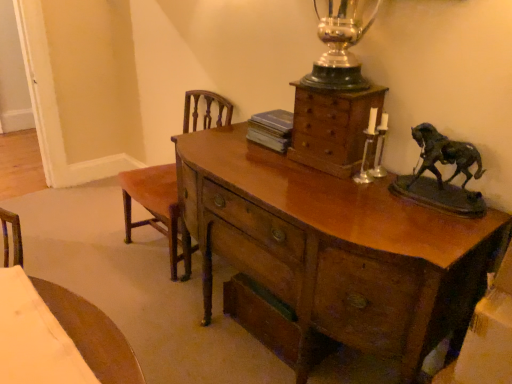
Describe the element at coordinates (332, 127) in the screenshot. The width and height of the screenshot is (512, 384). I see `wooden chest of drawers at upper center` at that location.

Locate an element on the screen. The height and width of the screenshot is (384, 512). blue paperback book at center is located at coordinates (271, 129).

You are a GUI agent. You are given a task and a screenshot of the screen. Output one action in this format:
    pyautogui.click(x=<x>, y=<y>)
    Task: Click on the wooden chest of drawers at upper center
    Image resolution: width=512 pixels, height=384 pixels.
    Given the screenshot: What is the action you would take?
    pyautogui.click(x=332, y=127)

The width and height of the screenshot is (512, 384). Identify the location of desk lying on the left of wooden chest of drawers at upper center. (328, 253).

Can you confirm if wooden chest of drawers at upper center is taller than glossy wood desk at center?

In fact, wooden chest of drawers at upper center may be shorter than glossy wood desk at center.

Based on their sizes in the image, would you say wooden chest of drawers at upper center is bigger or smaller than glossy wood desk at center?

wooden chest of drawers at upper center is smaller than glossy wood desk at center.

From a real-world perspective, is wooden chest of drawers at upper center beneath glossy wood desk at center?

Incorrect, from a real-world perspective, wooden chest of drawers at upper center is higher than glossy wood desk at center.

Can you tell me how much glossy wood desk at center and brown wood chair at left differ in facing direction?

There is a 0.0952-degree angle between the facing directions of glossy wood desk at center and brown wood chair at left.

Would you say brown wood chair at left is part of glossy wood desk at center's contents?

No, glossy wood desk at center does not contain brown wood chair at left.

Where is `desk in front of the brown wood chair at left`? desk in front of the brown wood chair at left is located at coordinates (328, 253).

Which of these two, glossy wood desk at center or brown wood chair at left, is wider?

glossy wood desk at center is wider.

Which is in front, blue paperback book at center or glossy wood desk at center?

Positioned in front is glossy wood desk at center.

From the picture: Is blue paperback book at center directly adjacent to glossy wood desk at center?

blue paperback book at center and glossy wood desk at center are clearly separated.

Which of these two, blue paperback book at center or glossy wood desk at center, stands shorter?

Standing shorter between the two is blue paperback book at center.

Is brown wood chair at left far away from blue paperback book at center?

brown wood chair at left is actually quite close to blue paperback book at center.

Is brown wood chair at left looking in the opposite direction of blue paperback book at center?

No, brown wood chair at left's orientation is not away from blue paperback book at center.

Is point (172, 267) farther from camera compared to point (267, 134)?

That is True.

From the image's perspective, between blue paperback book at center and brown wood chair at left, which one is located above?

From the image's view, blue paperback book at center is above.

Can you tell me how much blue paperback book at center and brown wood chair at left differ in facing direction?

The angular difference between blue paperback book at center and brown wood chair at left is 0.911 degrees.

Between blue paperback book at center and brown wood chair at left, which one has more height?

brown wood chair at left.

Which object is positioned more to the right, blue paperback book at center or brown wood chair at left?

From the viewer's perspective, blue paperback book at center appears more on the right side.

Measure the distance from glossy wood desk at center to blue paperback book at center.

The distance of glossy wood desk at center from blue paperback book at center is 19.56 inches.

Who is bigger, glossy wood desk at center or blue paperback book at center?

glossy wood desk at center.

Consider the image. Considering their positions, is glossy wood desk at center located in front of or behind blue paperback book at center?

glossy wood desk at center is in front of blue paperback book at center.

From the image's perspective, is glossy wood desk at center positioned above or below blue paperback book at center?

Based on their image positions, glossy wood desk at center is located beneath blue paperback book at center.

From the picture: Is brown wood chair at left not inside glossy wood desk at center?

Indeed, brown wood chair at left is completely outside glossy wood desk at center.

Is brown wood chair at left wider or thinner than glossy wood desk at center?

brown wood chair at left is thinner than glossy wood desk at center.

Locate an element on the screen. This screenshot has height=384, width=512. armchair above the glossy wood desk at center (from a real-world perspective) is located at coordinates (154, 204).

Where is `chest of drawers lying on the right of glossy wood desk at center`? This screenshot has width=512, height=384. chest of drawers lying on the right of glossy wood desk at center is located at coordinates (332, 127).

Find the location of a particular element. Image resolution: width=512 pixels, height=384 pixels. desk that appears below the brown wood chair at left (from the image's perspective) is located at coordinates (328, 253).

Looking at the image, which one is located further to blue paperback book at center, brown wood chair at left or wooden chest of drawers at upper center?

brown wood chair at left.

Consider the image. Looking at the image, which one is located closer to brown wood chair at left, glossy wood desk at center or blue paperback book at center?

Based on the image, blue paperback book at center appears to be nearer to brown wood chair at left.

When comparing their distances from glossy wood desk at center, does blue paperback book at center or brown wood chair at left seem further?

The object further to glossy wood desk at center is brown wood chair at left.

When comparing their distances from blue paperback book at center, does wooden chest of drawers at upper center or brown wood chair at left seem further?

brown wood chair at left is positioned further to the anchor blue paperback book at center.

Looking at the image, which one is located closer to glossy wood desk at center, brown wood chair at left or wooden chest of drawers at upper center?

wooden chest of drawers at upper center is positioned closer to the anchor glossy wood desk at center.

Based on the photo, which object lies further to the anchor point blue paperback book at center, glossy wood desk at center or brown wood chair at left?

Among the two, brown wood chair at left is located further to blue paperback book at center.

When comparing their distances from brown wood chair at left, does blue paperback book at center or wooden chest of drawers at upper center seem closer?

blue paperback book at center.

From the image, which object appears to be farther from blue paperback book at center, brown wood chair at left or glossy wood desk at center?

Based on the image, brown wood chair at left appears to be further to blue paperback book at center.

Where is `book between brown wood chair at left and wooden chest of drawers at upper center from left to right`? The height and width of the screenshot is (384, 512). book between brown wood chair at left and wooden chest of drawers at upper center from left to right is located at coordinates (271, 129).

Where is `book between glossy wood desk at center and brown wood chair at left along the z-axis`? Image resolution: width=512 pixels, height=384 pixels. book between glossy wood desk at center and brown wood chair at left along the z-axis is located at coordinates (271, 129).

This screenshot has height=384, width=512. Find the location of `the chest of drawers positioned between glossy wood desk at center and blue paperback book at center from near to far`. the chest of drawers positioned between glossy wood desk at center and blue paperback book at center from near to far is located at coordinates (332, 127).

Identify the location of chest of drawers between glossy wood desk at center and brown wood chair at left from front to back. (332, 127).